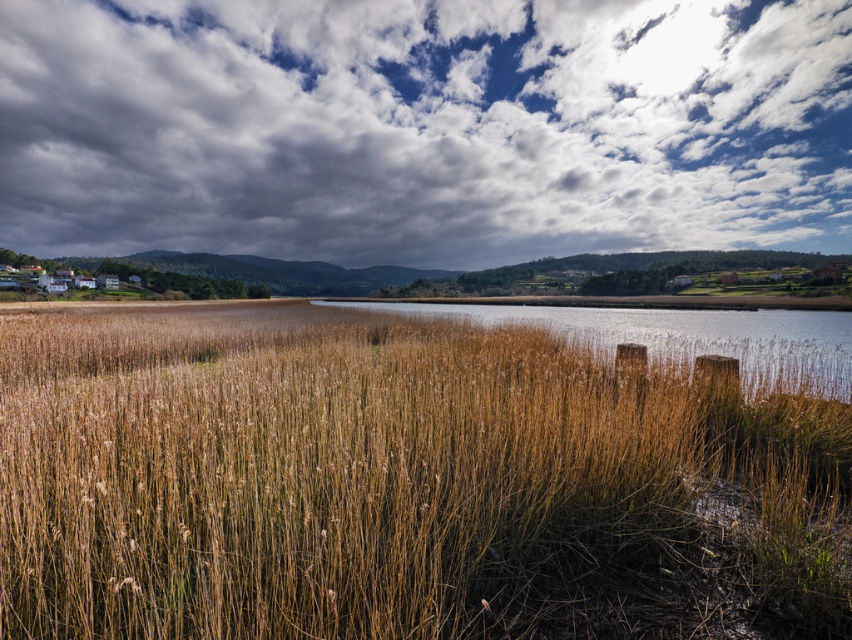
Question: Among these points, which one is farthest from the camera?

Choices:
 (A) (469, 320)
 (B) (550, 240)
 (C) (140, 426)

Answer: (B)

Question: Can you confirm if brown dry grass at center is positioned to the right of cloudy sky at upper center?

Choices:
 (A) yes
 (B) no

Answer: (B)

Question: Among these objects, which one is nearest to the camera?

Choices:
 (A) brown grassy reeds at center
 (B) cloudy sky at upper center
 (C) brown dry grass at center

Answer: (C)

Question: Which is farther from the brown grassy reeds at center?

Choices:
 (A) brown dry grass at center
 (B) cloudy sky at upper center

Answer: (B)

Question: Is brown dry grass at center below brown grassy reeds at center?

Choices:
 (A) no
 (B) yes

Answer: (B)

Question: Can you confirm if cloudy sky at upper center is positioned to the right of brown grassy reeds at center?

Choices:
 (A) yes
 (B) no

Answer: (B)